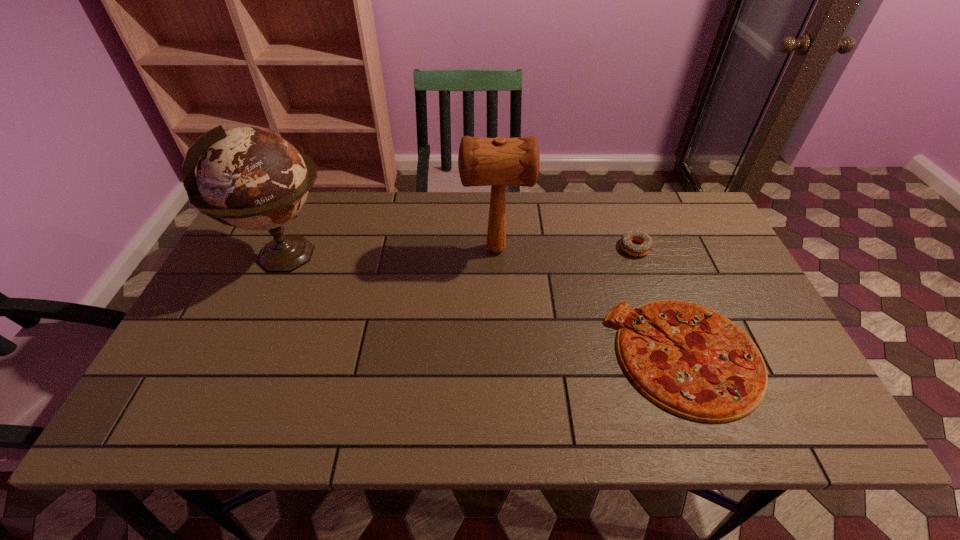
At what (x,y) coordinates should I click in order to perform the action: click on free area in between the leftmost object and the mallet. Please return your answer as a coordinate pair (x, y). Image resolution: width=960 pixels, height=540 pixels. Looking at the image, I should click on (391, 253).

Identify the location of the second closest object to the third tallest object. The height and width of the screenshot is (540, 960). (496, 162).

Where is `the closest object to the third tallest object`? the closest object to the third tallest object is located at coordinates (717, 374).

Locate an element on the screen. free space that satisfies the following two spatial constraints: 1. on the strike surface of the nearest object; 2. on the left side of the mallet is located at coordinates (499, 356).

Locate an element on the screen. blank space that satisfies the following two spatial constraints: 1. on the back side of the nearest object; 2. on the front of the globe showing Asia is located at coordinates (647, 256).

In order to click on vacant area that satisfies the following two spatial constraints: 1. on the strike surface of the third object from right to left; 2. on the left side of the shortest object in this screenshot , I will do `click(499, 356)`.

The height and width of the screenshot is (540, 960). What are the coordinates of `free space that satisfies the following two spatial constraints: 1. on the front of the pizza showing Asia; 2. on the right side of the globe` in the screenshot? It's located at (242, 356).

Find the location of `blank space that satisfies the following two spatial constraints: 1. on the back side of the shortest object; 2. on the strike surface of the mallet`. blank space that satisfies the following two spatial constraints: 1. on the back side of the shortest object; 2. on the strike surface of the mallet is located at coordinates (645, 249).

The width and height of the screenshot is (960, 540). What are the coordinates of `free space that satisfies the following two spatial constraints: 1. on the front of the leftmost object showing Asia; 2. on the left side of the shortest object` in the screenshot? It's located at (242, 356).